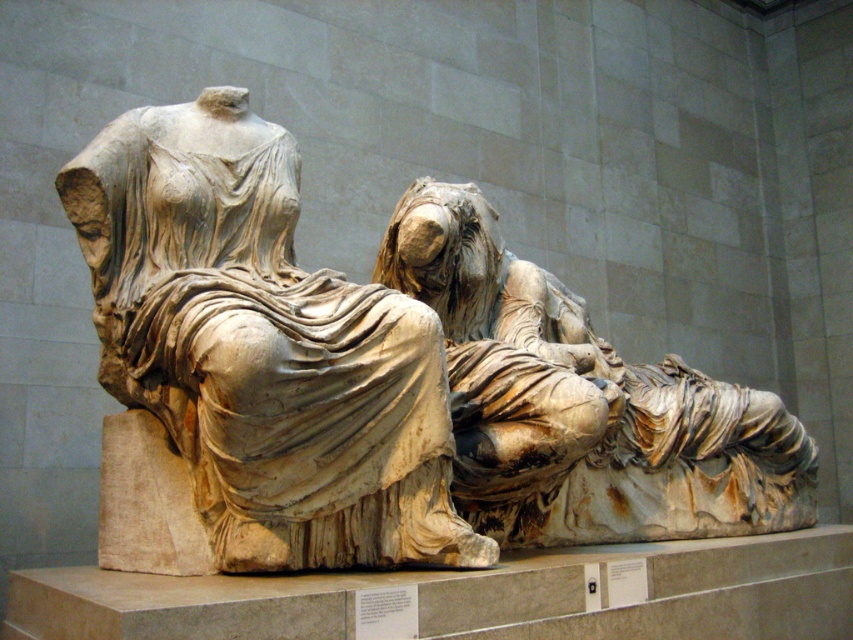
Question: Is white marble statue at left above marble statue at center?

Choices:
 (A) no
 (B) yes

Answer: (B)

Question: Does white marble statue at left appear on the right side of marble statue at center?

Choices:
 (A) no
 (B) yes

Answer: (A)

Question: Can you confirm if white marble statue at left is bigger than marble statue at center?

Choices:
 (A) no
 (B) yes

Answer: (A)